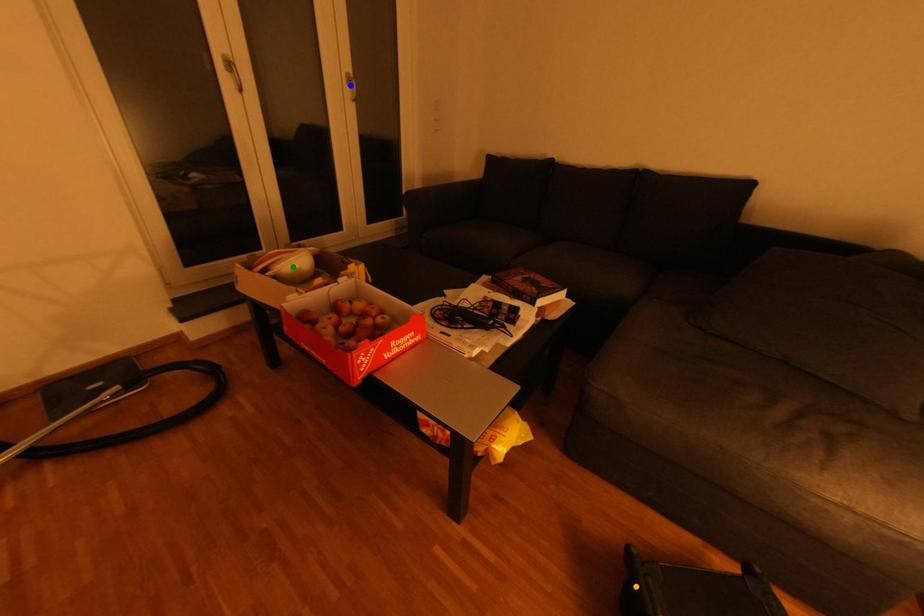
Order these from nearest to farthest:
green point | blue point | orange point

orange point → green point → blue point